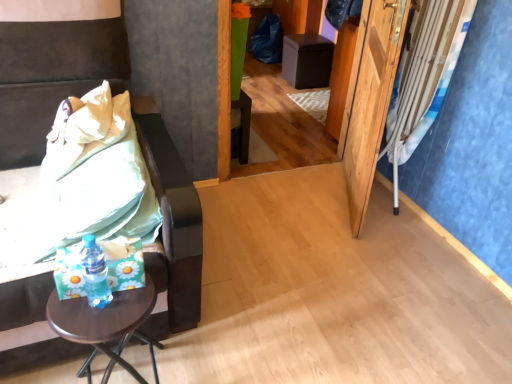
Image resolution: width=512 pixels, height=384 pixels. I want to click on vacant area that lies to the right of brown wooden side table at left, marked as the 1th furniture in a front-to-back arrangement, so click(x=281, y=271).